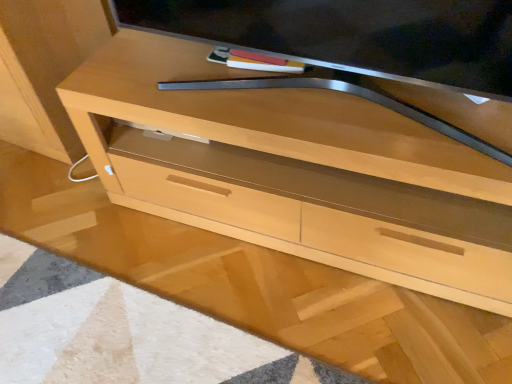
Question: Should I look upward or downward to see light wood chest of drawers at center?

Choices:
 (A) down
 (B) up

Answer: (B)

Question: Is satin silver tv at upper center shorter than light wood chest of drawers at center?

Choices:
 (A) yes
 (B) no

Answer: (A)

Question: Is satin silver tv at upper center next to light wood chest of drawers at center?

Choices:
 (A) yes
 (B) no

Answer: (B)

Question: From the image's perspective, would you say satin silver tv at upper center is positioned over light wood chest of drawers at center?

Choices:
 (A) yes
 (B) no

Answer: (A)

Question: From a real-world perspective, is satin silver tv at upper center located higher than light wood chest of drawers at center?

Choices:
 (A) no
 (B) yes

Answer: (B)

Question: Is satin silver tv at upper center in front of light wood chest of drawers at center?

Choices:
 (A) yes
 (B) no

Answer: (A)

Question: Can you confirm if satin silver tv at upper center is thinner than light wood chest of drawers at center?

Choices:
 (A) yes
 (B) no

Answer: (A)

Question: Is light wood chest of drawers at center further to camera compared to satin silver tv at upper center?

Choices:
 (A) no
 (B) yes

Answer: (B)

Question: Does light wood chest of drawers at center have a greater height compared to satin silver tv at upper center?

Choices:
 (A) no
 (B) yes

Answer: (B)

Question: From the image's perspective, would you say light wood chest of drawers at center is positioned over satin silver tv at upper center?

Choices:
 (A) no
 (B) yes

Answer: (A)

Question: Considering the relative positions of light wood chest of drawers at center and satin silver tv at upper center in the image provided, is light wood chest of drawers at center to the right of satin silver tv at upper center from the viewer's perspective?

Choices:
 (A) no
 (B) yes

Answer: (B)

Question: Is light wood chest of drawers at center facing towards satin silver tv at upper center?

Choices:
 (A) no
 (B) yes

Answer: (A)

Question: Is light wood chest of drawers at center shorter than satin silver tv at upper center?

Choices:
 (A) yes
 (B) no

Answer: (B)

Question: Considering their positions, is satin silver tv at upper center located in front of or behind light wood chest of drawers at center?

Choices:
 (A) front
 (B) behind

Answer: (A)